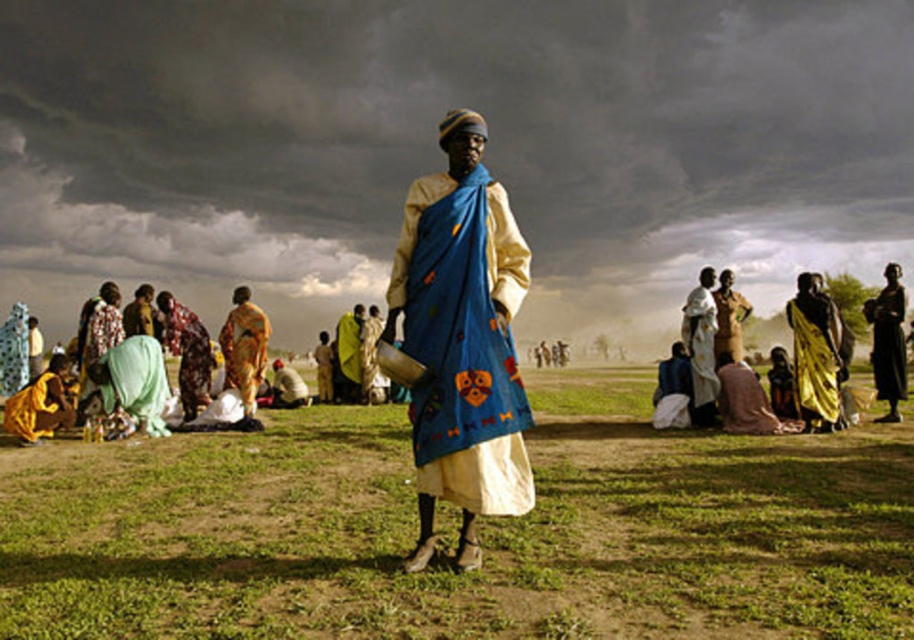
Based on the photo, you are a photographer standing at the center of the scene. You want to take a photo that includes both the black matte dress at right and the blue fabric cloth at center. What is the minimum distance you need to move to ensure both are in the frame?

The black matte dress at right is 3.37 meters away from the blue fabric cloth at center. To include both in the frame, you need to move 1.685 meters towards the black matte dress at right or the blue fabric cloth at center so that the distance between them is within your camera frame.

You are a photographer trying to capture a shot of the two dresses in the scene. You want to ensure that both dresses are fully visible in the frame. Given that the black matte dress at right is shorter in height compared to the printed fabric dress at center, which dress might require you to adjust your camera angle to include its entire length?

The black matte dress at right is not as tall as the printed fabric dress at center, so you might need to adjust the camera angle to ensure the entire length of the black matte dress at right is visible.

You are a photographer trying to capture the central figure in the scene. You notice the brown leather jacket at center and the matte yellow fabric at center. Which object should you focus on to ensure it takes up more space in your photo?

The brown leather jacket at center is larger in size than the matte yellow fabric at center, so focusing on it will ensure it takes up more space in your photo.